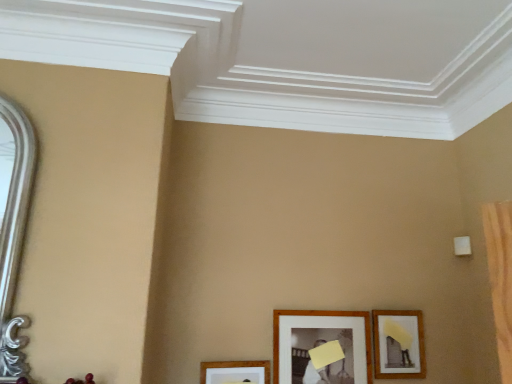
Describe the element at coordinates (398, 344) in the screenshot. I see `wooden framed picture at lower right, the third picture frame when ordered from left to right` at that location.

What is the approximate width of wooden picture frame at lower center, the first picture frame positioned from the left?

1.29 inches.

Find the location of a particular element. This screenshot has height=384, width=512. wooden picture frame at lower center, the 3th picture frame viewed from the right is located at coordinates (234, 372).

Where is `wooden framed picture at lower right, the third picture frame when ordered from left to right`? This screenshot has width=512, height=384. wooden framed picture at lower right, the third picture frame when ordered from left to right is located at coordinates (398, 344).

Considering the positions of objects wooden framed picture at lower right, the third picture frame when ordered from left to right, and wooden picture frame at lower center, placed as the 2th picture frame when sorted from left to right, in the image provided, who is in front, wooden framed picture at lower right, the third picture frame when ordered from left to right, or wooden picture frame at lower center, placed as the 2th picture frame when sorted from left to right,?

wooden picture frame at lower center, placed as the 2th picture frame when sorted from left to right, is more forward.

Is wooden framed picture at lower right, the third picture frame when ordered from left to right, positioned with its back to wooden picture frame at lower center, placed as the 2th picture frame when sorted from left to right?

wooden framed picture at lower right, the third picture frame when ordered from left to right, does not have its back to wooden picture frame at lower center, placed as the 2th picture frame when sorted from left to right.

From the image's perspective, is wooden framed picture at lower right, the third picture frame when ordered from left to right, located above or below wooden picture frame at lower center, placed as the 2th picture frame when sorted from left to right?

wooden framed picture at lower right, the third picture frame when ordered from left to right, is above wooden picture frame at lower center, placed as the 2th picture frame when sorted from left to right.

Is wooden picture frame at lower center, the 3th picture frame viewed from the right, beside wooden picture frame at lower center, which is counted as the second picture frame, starting from the right?

wooden picture frame at lower center, the 3th picture frame viewed from the right, is not next to wooden picture frame at lower center, which is counted as the second picture frame, starting from the right, and they're not touching.

From a real-world perspective, is wooden picture frame at lower center, the 3th picture frame viewed from the right, physically located above or below wooden picture frame at lower center, placed as the 2th picture frame when sorted from left to right?

wooden picture frame at lower center, the 3th picture frame viewed from the right, is below wooden picture frame at lower center, placed as the 2th picture frame when sorted from left to right.

What's the angular difference between wooden picture frame at lower center, placed as the 2th picture frame when sorted from left to right, and wooden picture frame at lower center, the first picture frame positioned from the left,'s facing directions?

1.27 degrees separate the facing orientations of wooden picture frame at lower center, placed as the 2th picture frame when sorted from left to right, and wooden picture frame at lower center, the first picture frame positioned from the left.

Considering the positions of point (351, 366) and point (254, 371), is point (351, 366) closer or farther from the camera than point (254, 371)?

Point (351, 366) is farther from the camera than point (254, 371).

Is wooden picture frame at lower center, which is counted as the second picture frame, starting from the right, facing away from wooden picture frame at lower center, the first picture frame positioned from the left?

No, wooden picture frame at lower center, which is counted as the second picture frame, starting from the right, is not facing the opposite direction of wooden picture frame at lower center, the first picture frame positioned from the left.

Find the location of a particular element. picture frame below the wooden picture frame at lower center, placed as the 2th picture frame when sorted from left to right (from a real-world perspective) is located at coordinates (234, 372).

Considering the sizes of objects wooden framed picture at lower right, the third picture frame when ordered from left to right, and wooden picture frame at lower center, the 3th picture frame viewed from the right, in the image provided, who is wider, wooden framed picture at lower right, the third picture frame when ordered from left to right, or wooden picture frame at lower center, the 3th picture frame viewed from the right,?

wooden framed picture at lower right, the third picture frame when ordered from left to right.

At what (x,y) coordinates should I click in order to perform the action: click on the 2nd picture frame positioned above the wooden picture frame at lower center, the 3th picture frame viewed from the right (from the image's perspective). Please return your answer as a coordinate pair (x, y). The width and height of the screenshot is (512, 384). Looking at the image, I should click on (398, 344).

Can you tell me how much wooden framed picture at lower right, the third picture frame when ordered from left to right, and wooden picture frame at lower center, the 3th picture frame viewed from the right, differ in facing direction?

1.76 degrees separate the facing orientations of wooden framed picture at lower right, the third picture frame when ordered from left to right, and wooden picture frame at lower center, the 3th picture frame viewed from the right.

From a real-world perspective, which is physically below, wooden framed picture at lower right, the third picture frame when ordered from left to right, or wooden picture frame at lower center, the first picture frame positioned from the left?

From a 3D spatial view, wooden picture frame at lower center, the first picture frame positioned from the left, is below.

Does wooden picture frame at lower center, the first picture frame positioned from the left, touch wooden framed picture at lower right, the third picture frame when ordered from left to right?

No, wooden picture frame at lower center, the first picture frame positioned from the left, is not with wooden framed picture at lower right, the third picture frame when ordered from left to right.

Does wooden picture frame at lower center, the first picture frame positioned from the left, have a larger size compared to wooden framed picture at lower right, the third picture frame when ordered from left to right?

Actually, wooden picture frame at lower center, the first picture frame positioned from the left, might be smaller than wooden framed picture at lower right, the third picture frame when ordered from left to right.

Does wooden picture frame at lower center, the 3th picture frame viewed from the right, have a lesser height compared to wooden framed picture at lower right, the third picture frame when ordered from left to right?

Yes.

Is wooden picture frame at lower center, placed as the 2th picture frame when sorted from left to right, oriented away from wooden framed picture at lower right, the third picture frame when ordered from left to right?

No, wooden framed picture at lower right, the third picture frame when ordered from left to right, is not at the back of wooden picture frame at lower center, placed as the 2th picture frame when sorted from left to right.

From the image's perspective, is wooden picture frame at lower center, which is counted as the second picture frame, starting from the right, under wooden framed picture at lower right, placed as the first picture frame when sorted from right to left?

Correct, wooden picture frame at lower center, which is counted as the second picture frame, starting from the right, appears lower than wooden framed picture at lower right, placed as the first picture frame when sorted from right to left, in the image.

Is wooden picture frame at lower center, which is counted as the second picture frame, starting from the right, bigger than wooden framed picture at lower right, placed as the first picture frame when sorted from right to left?

Indeed, wooden picture frame at lower center, which is counted as the second picture frame, starting from the right, has a larger size compared to wooden framed picture at lower right, placed as the first picture frame when sorted from right to left.

Can you confirm if wooden picture frame at lower center, placed as the 2th picture frame when sorted from left to right, is shorter than wooden framed picture at lower right, placed as the first picture frame when sorted from right to left?

No.

There is a wooden framed picture at lower right, the third picture frame when ordered from left to right. Identify the location of the 1st picture frame below it (from a real-world perspective). This screenshot has width=512, height=384. click(322, 347).

At what (x,y) coordinates should I click in order to perform the action: click on the 1st picture frame above the wooden picture frame at lower center, the 3th picture frame viewed from the right (from the image's perspective). Please return your answer as a coordinate pair (x, y). The width and height of the screenshot is (512, 384). Looking at the image, I should click on (322, 347).

When comparing their distances from wooden picture frame at lower center, which is counted as the second picture frame, starting from the right, does wooden picture frame at lower center, the first picture frame positioned from the left, or wooden framed picture at lower right, placed as the first picture frame when sorted from right to left, seem closer?

wooden framed picture at lower right, placed as the first picture frame when sorted from right to left, lies closer to wooden picture frame at lower center, which is counted as the second picture frame, starting from the right, than the other object.

When comparing their distances from wooden picture frame at lower center, placed as the 2th picture frame when sorted from left to right, does wooden framed picture at lower right, placed as the first picture frame when sorted from right to left, or wooden picture frame at lower center, the first picture frame positioned from the left, seem closer?

wooden framed picture at lower right, placed as the first picture frame when sorted from right to left.

Based on the photo, from the image, which object appears to be nearer to wooden framed picture at lower right, the third picture frame when ordered from left to right, wooden picture frame at lower center, the first picture frame positioned from the left, or wooden picture frame at lower center, placed as the 2th picture frame when sorted from left to right?

The object closer to wooden framed picture at lower right, the third picture frame when ordered from left to right, is wooden picture frame at lower center, placed as the 2th picture frame when sorted from left to right.

Considering their positions, is wooden picture frame at lower center, which is counted as the second picture frame, starting from the right, positioned further to wooden picture frame at lower center, the 3th picture frame viewed from the right, than wooden framed picture at lower right, placed as the first picture frame when sorted from right to left?

The object further to wooden picture frame at lower center, the 3th picture frame viewed from the right, is wooden framed picture at lower right, placed as the first picture frame when sorted from right to left.

From the picture: Based on their spatial positions, is wooden picture frame at lower center, placed as the 2th picture frame when sorted from left to right, or wooden picture frame at lower center, the first picture frame positioned from the left, further from wooden framed picture at lower right, placed as the first picture frame when sorted from right to left?

wooden picture frame at lower center, the first picture frame positioned from the left.

Estimate the real-world distances between objects in this image. Which object is closer to wooden picture frame at lower center, the 3th picture frame viewed from the right, wooden framed picture at lower right, the third picture frame when ordered from left to right, or wooden picture frame at lower center, which is counted as the second picture frame, starting from the right?

The object closer to wooden picture frame at lower center, the 3th picture frame viewed from the right, is wooden picture frame at lower center, which is counted as the second picture frame, starting from the right.

The height and width of the screenshot is (384, 512). What are the coordinates of `picture frame between wooden picture frame at lower center, the 3th picture frame viewed from the right, and wooden framed picture at lower right, the third picture frame when ordered from left to right, in the horizontal direction` in the screenshot? It's located at (322, 347).